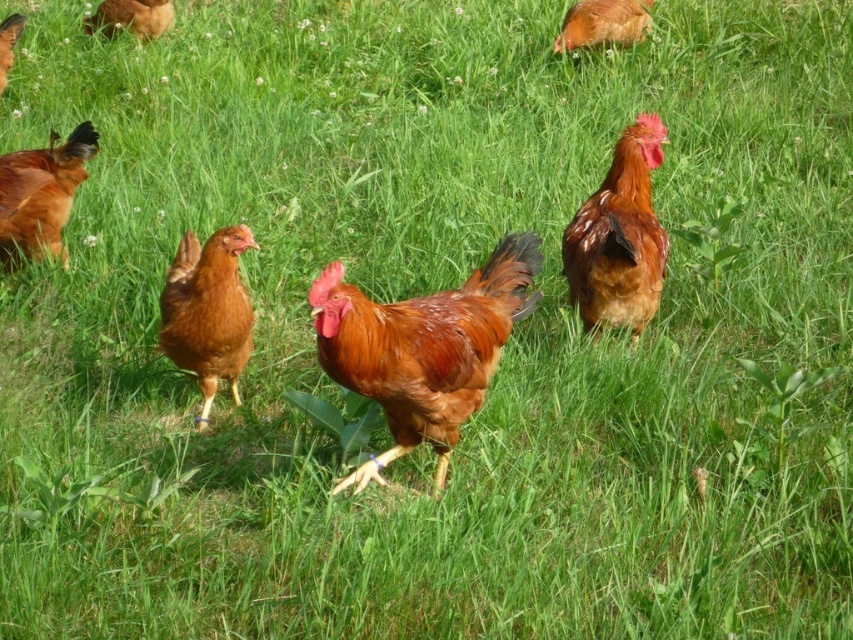
Question: Can you confirm if satin brown rooster at center is wider than golden brown feathers at upper right?

Choices:
 (A) no
 (B) yes

Answer: (A)

Question: Which point appears closest to the camera in this image?

Choices:
 (A) (614, 13)
 (B) (228, 372)

Answer: (B)

Question: Is the position of satin brown rooster at center more distant than that of matte brown chicken at upper left?

Choices:
 (A) yes
 (B) no

Answer: (B)

Question: Which object is the closest to the golden brown feathers at upper right?

Choices:
 (A) matte brown chicken at center
 (B) satin brown rooster at center
 (C) matte brown chicken at left

Answer: (C)

Question: Does shiny brown rooster at center have a greater width compared to matte brown chicken at center?

Choices:
 (A) no
 (B) yes

Answer: (A)

Question: Which object is farther from the camera taking this photo?

Choices:
 (A) brown feathered chicken at upper left
 (B) matte brown chicken at center
 (C) satin brown rooster at center

Answer: (A)